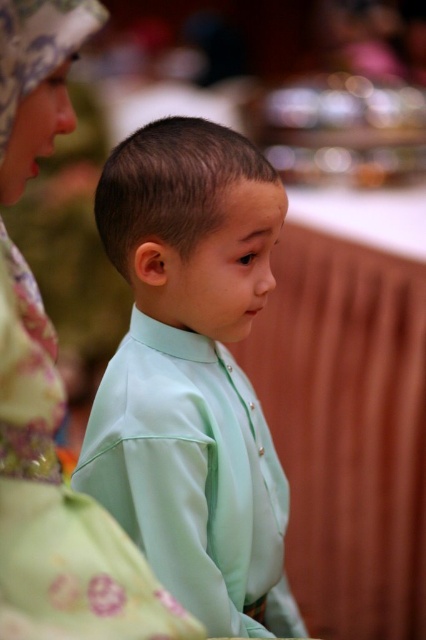
Who is positioned more to the right, light green satin shirt at center or matte green shirt at center?

light green satin shirt at center is more to the right.

Can you confirm if light green satin shirt at center is thinner than matte green shirt at center?

No.

Is point (265, 228) farther from viewer compared to point (39, 609)?

Yes, it is.

Image resolution: width=426 pixels, height=640 pixels. What are the coordinates of `light green satin shirt at center` in the screenshot? It's located at (192, 374).